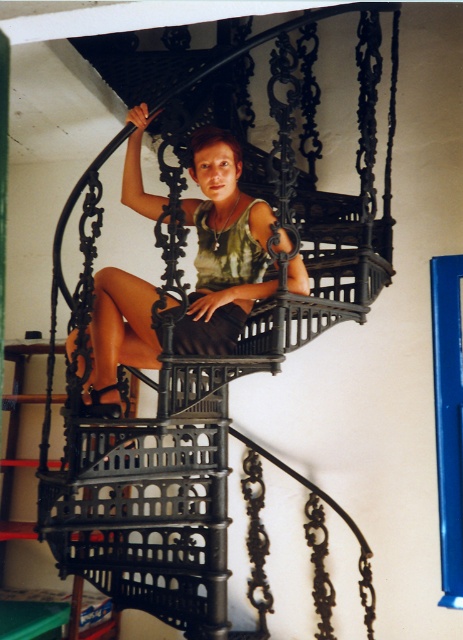
Question: Can you confirm if matte green tank top at center is bigger than green matte dress at center?

Choices:
 (A) no
 (B) yes

Answer: (B)

Question: Which point is closer to the camera?

Choices:
 (A) green matte dress at center
 (B) matte green tank top at center

Answer: (A)

Question: Where is matte green tank top at center located in relation to green matte dress at center in the image?

Choices:
 (A) below
 (B) above

Answer: (B)

Question: Which point appears closest to the camera in this image?

Choices:
 (A) (224, 321)
 (B) (306, 292)

Answer: (B)

Question: Is matte green tank top at center positioned before green matte dress at center?

Choices:
 (A) yes
 (B) no

Answer: (B)